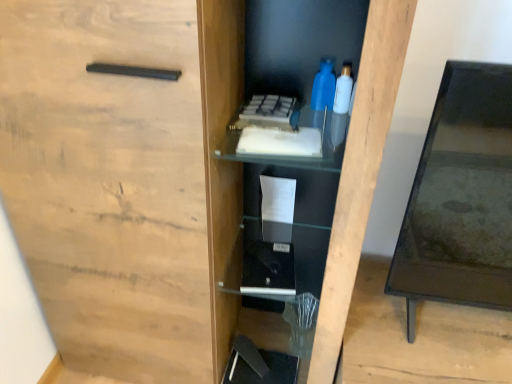
Identify the location of free space to the left of black glass table at right. Image resolution: width=512 pixels, height=384 pixels. (373, 337).